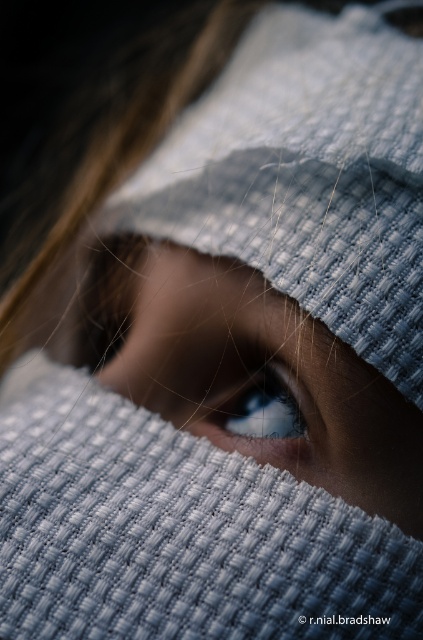
Question: Considering the relative positions of blue glossy eye at center and glossy blue eye at center in the image provided, where is blue glossy eye at center located with respect to glossy blue eye at center?

Choices:
 (A) below
 (B) above

Answer: (B)

Question: Can you confirm if blue glossy eye at center is bigger than glossy blue eye at center?

Choices:
 (A) no
 (B) yes

Answer: (B)

Question: Which point is farther to the camera?

Choices:
 (A) (277, 410)
 (B) (114, 246)

Answer: (B)

Question: Which point is closer to the camera taking this photo?

Choices:
 (A) (225, 416)
 (B) (140, 248)

Answer: (A)

Question: Which point appears closest to the camera in this image?

Choices:
 (A) (271, 438)
 (B) (395, 509)

Answer: (B)

Question: From the image, what is the correct spatial relationship of blue glossy eye at center in relation to glossy blue eye at center?

Choices:
 (A) right
 (B) left

Answer: (B)